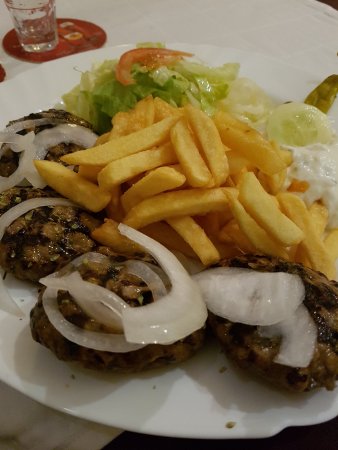
At what (x,y) coordinates should I click in order to perform the action: click on coaster. Please return your answer as a coordinate pair (x, y). Looking at the image, I should click on (77, 30).